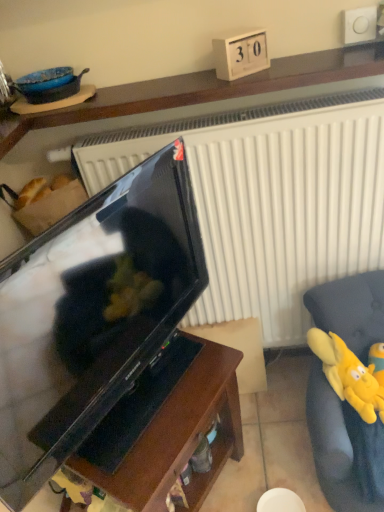
I want to click on free point above black glossy tv stand at center, arranged as the 1th furniture when ordered from the bottom (from a real-world perspective), so click(x=156, y=400).